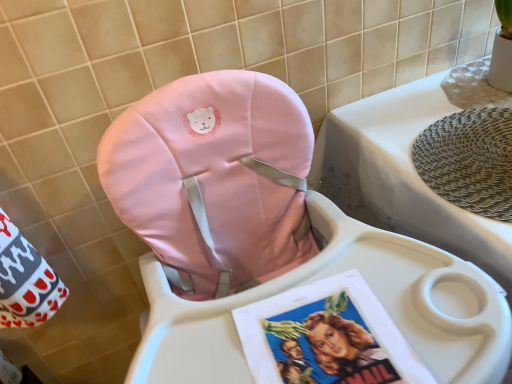
Consider the image. Measure the distance between point [403,198] and camera.

They are 35.08 inches apart.

You are a GUI agent. You are given a task and a screenshot of the screen. Output one action in this format:
    pyautogui.click(x=<x>, y=<y>)
    Task: Click on the white plastic changing table at upper right
    The height and width of the screenshot is (384, 512).
    Given the screenshot: What is the action you would take?
    pyautogui.click(x=406, y=172)

What is the approximate height of white plastic changing table at upper right?

white plastic changing table at upper right is 29.62 inches tall.

The height and width of the screenshot is (384, 512). What do you see at coordinates (406, 172) in the screenshot? I see `white plastic changing table at upper right` at bounding box center [406, 172].

What is the approximate height of matte pink cushion at center?

matte pink cushion at center is 39.36 inches in height.

What do you see at coordinates (330, 275) in the screenshot? Image resolution: width=512 pixels, height=384 pixels. I see `matte pink cushion at center` at bounding box center [330, 275].

What is the approximate width of matte pink cushion at center?

matte pink cushion at center is 28.62 inches wide.

Locate an element on the screen. matte pink cushion at center is located at coordinates (330, 275).

Locate an element on the screen. This screenshot has width=512, height=384. white plastic changing table at upper right is located at coordinates (406, 172).

Between matte pink cushion at center and white plastic changing table at upper right, which one appears on the left side from the viewer's perspective?

matte pink cushion at center.

Is matte pink cushion at center in front of or behind white plastic changing table at upper right in the image?

Visually, matte pink cushion at center is located in front of white plastic changing table at upper right.

Considering the positions of points (418, 304) and (417, 215), is point (418, 304) closer to camera compared to point (417, 215)?

Yes, it is.

From the image's perspective, between matte pink cushion at center and white plastic changing table at upper right, which one is located above?

From the image's view, white plastic changing table at upper right is above.

From a real-world perspective, is matte pink cushion at center on white plastic changing table at upper right?

Yes, from a real-world perspective, matte pink cushion at center is on top of white plastic changing table at upper right.

Can you confirm if matte pink cushion at center is thinner than white plastic changing table at upper right?

In fact, matte pink cushion at center might be wider than white plastic changing table at upper right.

Does matte pink cushion at center have a lesser height compared to white plastic changing table at upper right?

Incorrect, the height of matte pink cushion at center does not fall short of that of white plastic changing table at upper right.

Is matte pink cushion at center smaller than white plastic changing table at upper right?

No, matte pink cushion at center is not smaller than white plastic changing table at upper right.

Can white plastic changing table at upper right be found inside matte pink cushion at center?

No, white plastic changing table at upper right is located outside of matte pink cushion at center.

Can you see matte pink cushion at center touching white plastic changing table at upper right?

They are not placed beside each other.

Could you tell me if matte pink cushion at center is facing white plastic changing table at upper right?

No, matte pink cushion at center does not turn towards white plastic changing table at upper right.

I want to click on changing table above the matte pink cushion at center (from the image's perspective), so click(406, 172).

Visually, is white plastic changing table at upper right positioned to the left or to the right of matte pink cushion at center?

white plastic changing table at upper right is to the right of matte pink cushion at center.

Based on the photo, does white plastic changing table at upper right come behind matte pink cushion at center?

Yes, it is.

Which is closer to the camera, (422, 214) or (394, 290)?

The point (394, 290) is closer.

From the image's perspective, between white plastic changing table at upper right and matte pink cushion at center, who is located below?

matte pink cushion at center is shown below in the image.

From a real-world perspective, is white plastic changing table at upper right located beneath matte pink cushion at center?

Yes, from a real-world perspective, white plastic changing table at upper right is below matte pink cushion at center.

Can you confirm if white plastic changing table at upper right is wider than matte pink cushion at center?

No, white plastic changing table at upper right is not wider than matte pink cushion at center.

Based on the photo, between white plastic changing table at upper right and matte pink cushion at center, which one has more height?

matte pink cushion at center is taller.

Does white plastic changing table at upper right have a smaller size compared to matte pink cushion at center?

Correct, white plastic changing table at upper right occupies less space than matte pink cushion at center.

Is matte pink cushion at center a part of white plastic changing table at upper right?

No, matte pink cushion at center is not surrounded by white plastic changing table at upper right.

Is white plastic changing table at upper right far away from matte pink cushion at center?

No, white plastic changing table at upper right is in close proximity to matte pink cushion at center.

Is white plastic changing table at upper right facing towards matte pink cushion at center?

No, white plastic changing table at upper right is not facing towards matte pink cushion at center.

What's the angular difference between white plastic changing table at upper right and matte pink cushion at center's facing directions?

The angular difference between white plastic changing table at upper right and matte pink cushion at center is 1.05 degrees.

Find the location of `changing table that is under the matte pink cushion at center (from a real-world perspective)`. changing table that is under the matte pink cushion at center (from a real-world perspective) is located at coordinates (406, 172).

Where is `baby carriage in front of the white plastic changing table at upper right`? baby carriage in front of the white plastic changing table at upper right is located at coordinates (330, 275).

At what (x,y) coordinates should I click in order to perform the action: click on baby carriage that appears below the white plastic changing table at upper right (from the image's perspective). Please return your answer as a coordinate pair (x, y). The width and height of the screenshot is (512, 384). Looking at the image, I should click on (330, 275).